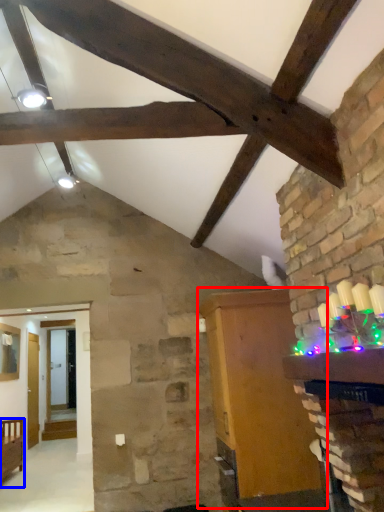
Question: Which of the following is the closest to the observer, furniture (highlighted by a red box) or furniture (highlighted by a blue box)?

Choices:
 (A) furniture
 (B) furniture

Answer: (A)